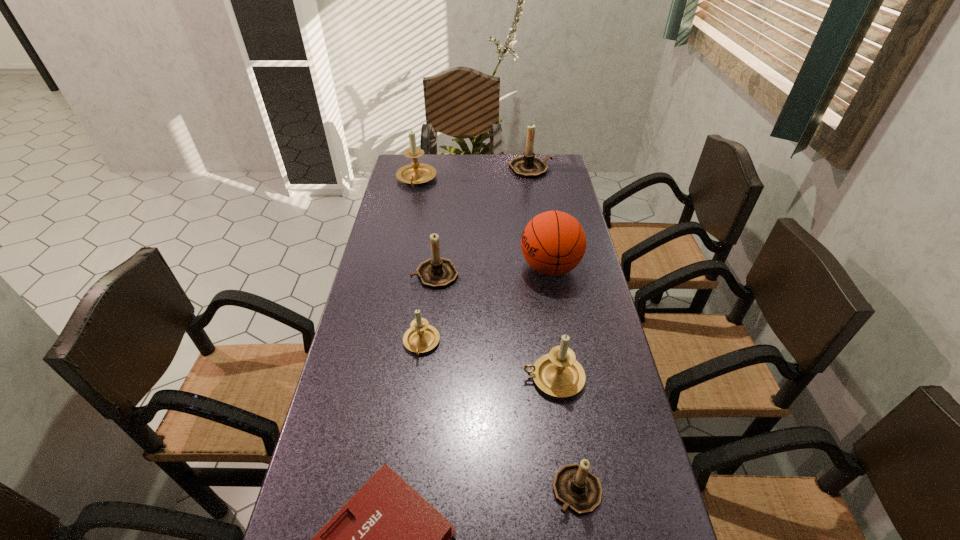
At what (x,y) coordinates should I click in order to perform the action: click on free space that satisfies the following two spatial constraints: 1. on the side with logo of the basketball; 2. with a handle on the side of the smallest beige candle holder. Please return your answer as a coordinate pair (x, y). Looking at the image, I should click on (564, 343).

Find the location of a particular element. free region that satisfies the following two spatial constraints: 1. with a handle on the side of the smallest beige candle holder; 2. on the right side of the nearest brown candle holder is located at coordinates (403, 490).

You are a GUI agent. You are given a task and a screenshot of the screen. Output one action in this format:
    pyautogui.click(x=<x>, y=<y>)
    Task: Click on the vacant position in the image that satisfies the following two spatial constraints: 1. on the side with logo of the basketball; 2. with a handle on the side of the smallest beige candle holder
    The height and width of the screenshot is (540, 960).
    Given the screenshot: What is the action you would take?
    pyautogui.click(x=564, y=343)